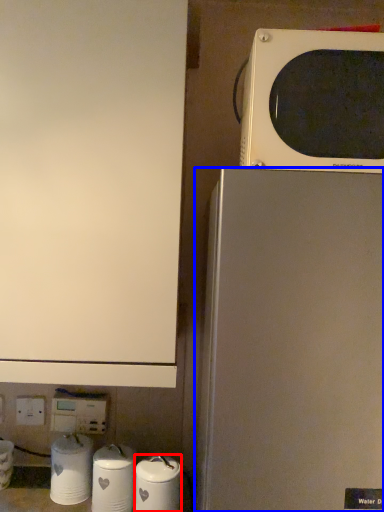
Question: Which of the following is the closest to the observer, appliance (highlighted by a red box) or refrigerator (highlighted by a blue box)?

Choices:
 (A) appliance
 (B) refrigerator

Answer: (B)